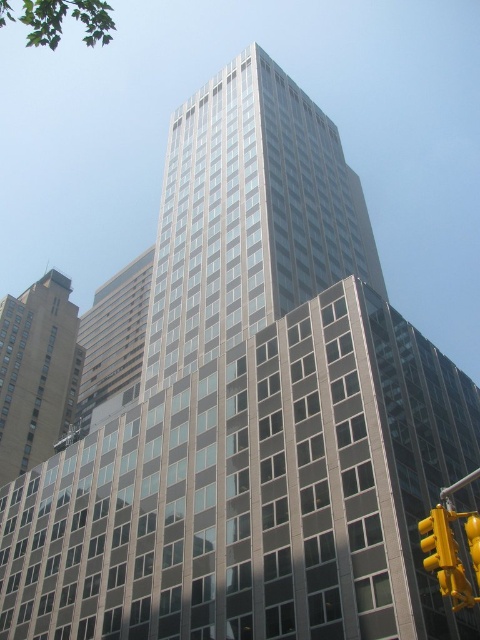
Can you confirm if beige stone building at left is positioned below yellow metallic traffic light at lower right?

No.

Is beige stone building at left bigger than yellow metallic traffic light at lower right?

Yes.

Describe the element at coordinates (36, 371) in the screenshot. The height and width of the screenshot is (640, 480). I see `beige stone building at left` at that location.

This screenshot has width=480, height=640. What are the coordinates of `beige stone building at left` in the screenshot? It's located at (36, 371).

Does beige stone building at left have a larger size compared to yellow plastic traffic light at lower right?

Yes, beige stone building at left is bigger than yellow plastic traffic light at lower right.

Can you confirm if beige stone building at left is positioned above yellow plastic traffic light at lower right?

Indeed, beige stone building at left is positioned over yellow plastic traffic light at lower right.

Between point (14, 358) and point (448, 524), which one is positioned in front?

Point (448, 524) is more forward.

At what (x,y) coordinates should I click in order to perform the action: click on beige stone building at left. Please return your answer as a coordinate pair (x, y). The height and width of the screenshot is (640, 480). Looking at the image, I should click on (36, 371).

Does yellow metallic traffic light at lower right appear on the left side of yellow plastic traffic light at lower right?

In fact, yellow metallic traffic light at lower right is to the right of yellow plastic traffic light at lower right.

Is point (472, 564) behind point (435, 513)?

Yes, point (472, 564) is farther from viewer.

The height and width of the screenshot is (640, 480). What do you see at coordinates (451, 554) in the screenshot?
I see `yellow metallic traffic light at lower right` at bounding box center [451, 554].

Image resolution: width=480 pixels, height=640 pixels. In order to click on yellow metallic traffic light at lower right in this screenshot , I will do `click(451, 554)`.